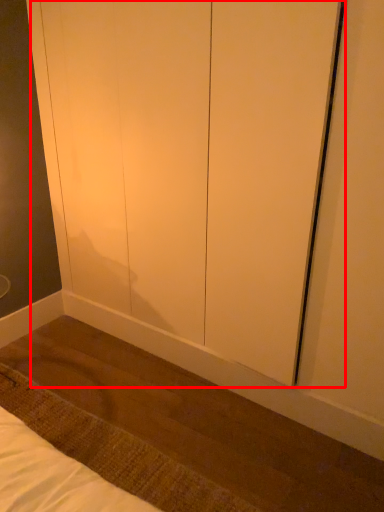
Question: From the image's perspective, what is the correct spatial relationship of screen door (annotated by the red box) in relation to mat?

Choices:
 (A) above
 (B) below

Answer: (A)